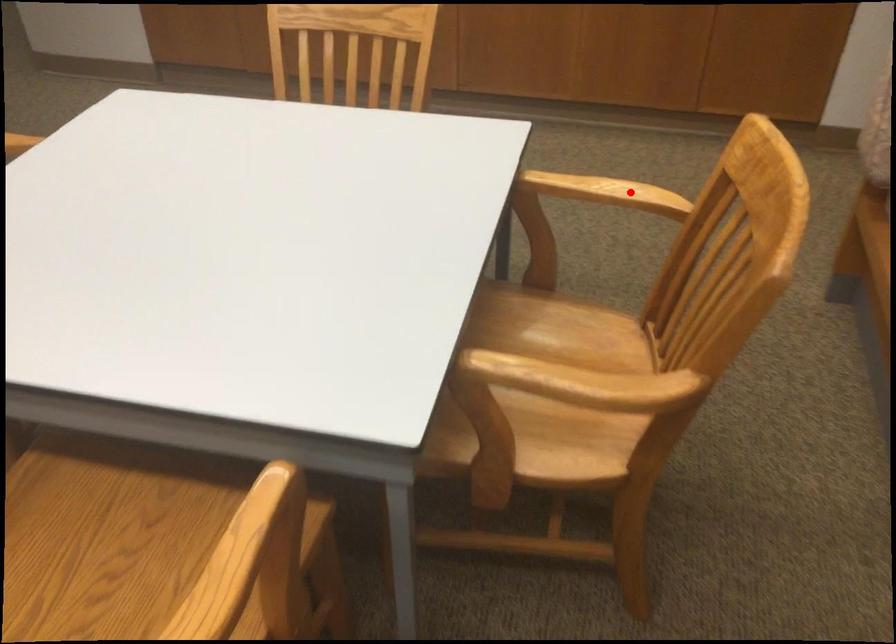
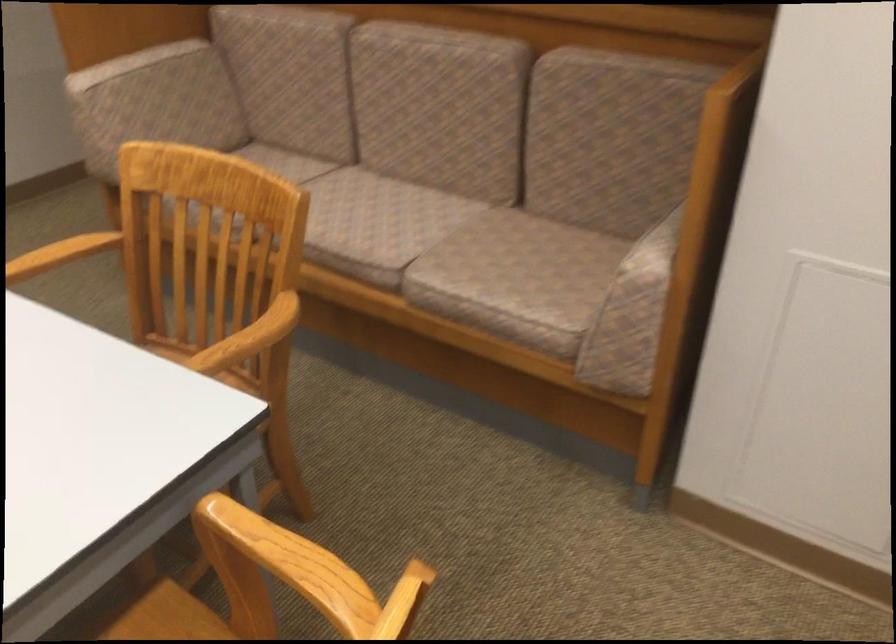
The point at the highlighted location is marked in the first image. Where is the corresponding point in the second image?

(62, 252)